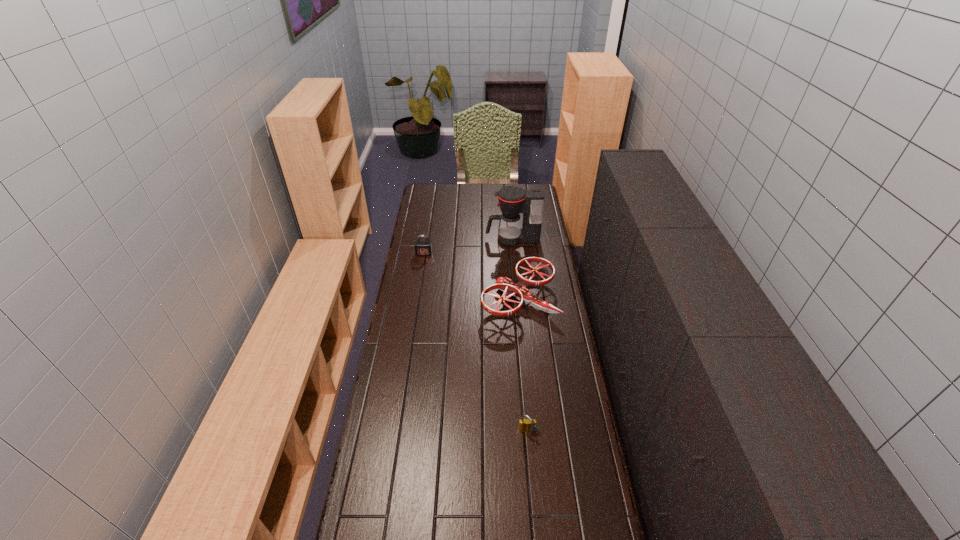
The image size is (960, 540). What are the coordinates of `vacant region located on the front of the farther padlock near the keyhole` in the screenshot? It's located at (421, 272).

The width and height of the screenshot is (960, 540). Identify the location of free location located 0.260m on the left of the drone. (423, 299).

Where is `free space located 0.280m on the side with the combination dials of the nearest object`? This screenshot has width=960, height=540. free space located 0.280m on the side with the combination dials of the nearest object is located at coordinates (536, 525).

This screenshot has height=540, width=960. Identify the location of object at the left edge. (422, 248).

Identify the location of coffee maker located in the right edge section of the desktop. This screenshot has height=540, width=960. (512, 200).

Where is `drone that is at the right edge`? drone that is at the right edge is located at coordinates (519, 291).

In the image, there is a desktop. Where is `vacant area at the far edge`? Image resolution: width=960 pixels, height=540 pixels. vacant area at the far edge is located at coordinates (463, 187).

Locate an element on the screen. This screenshot has width=960, height=540. free space at the left edge of the desktop is located at coordinates (402, 279).

Locate an element on the screen. Image resolution: width=960 pixels, height=540 pixels. blank space at the right edge of the desktop is located at coordinates (589, 495).

You are a GUI agent. You are given a task and a screenshot of the screen. Output one action in this format:
    pyautogui.click(x=<x>, y=<y>)
    Task: Click on the free space between the shorter padlock and the drone
    The width and height of the screenshot is (960, 540).
    Given the screenshot: What is the action you would take?
    pyautogui.click(x=523, y=365)